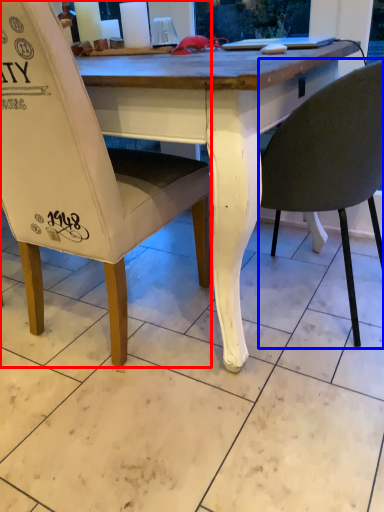
Question: Which object is closer to the camera taking this photo, chair (highlighted by a red box) or chair (highlighted by a blue box)?

Choices:
 (A) chair
 (B) chair

Answer: (A)